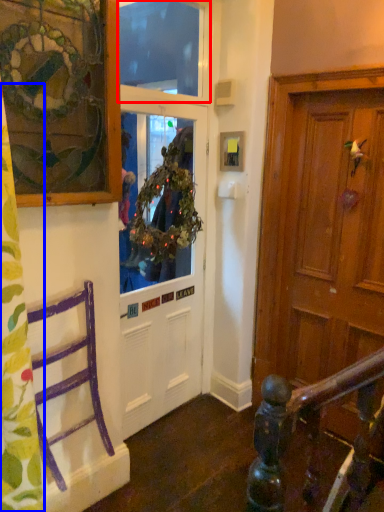
Question: Which point is closer to the camera, window screen (highlighted by a red box) or curtain (highlighted by a blue box)?

Choices:
 (A) window screen
 (B) curtain

Answer: (B)